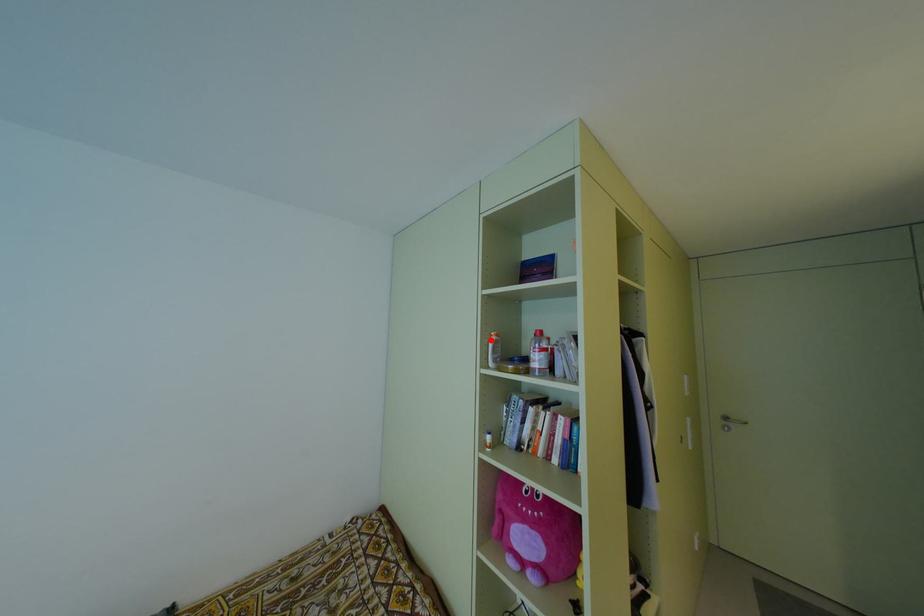
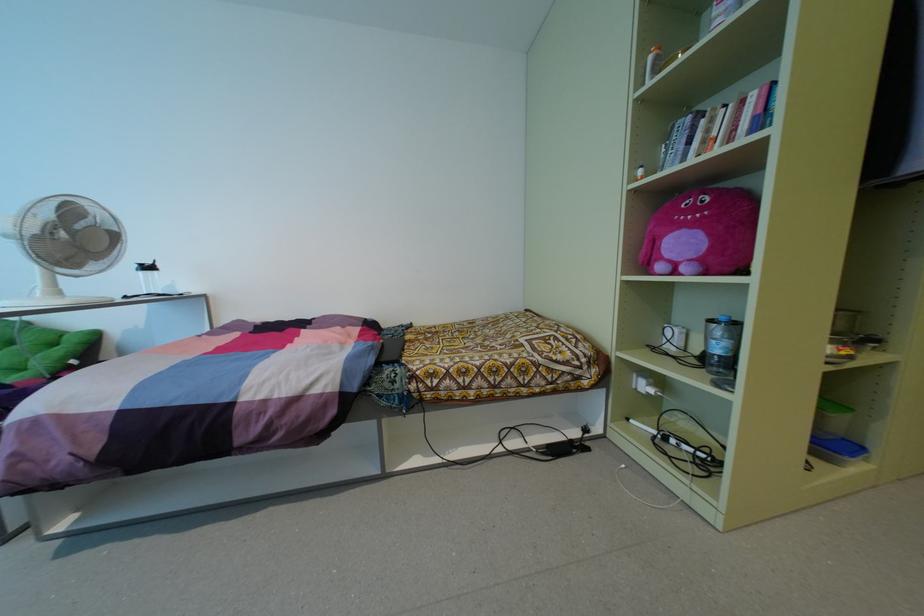
The point at the highlighted location is marked in the first image. Where is the corresponding point in the second image?

(650, 57)